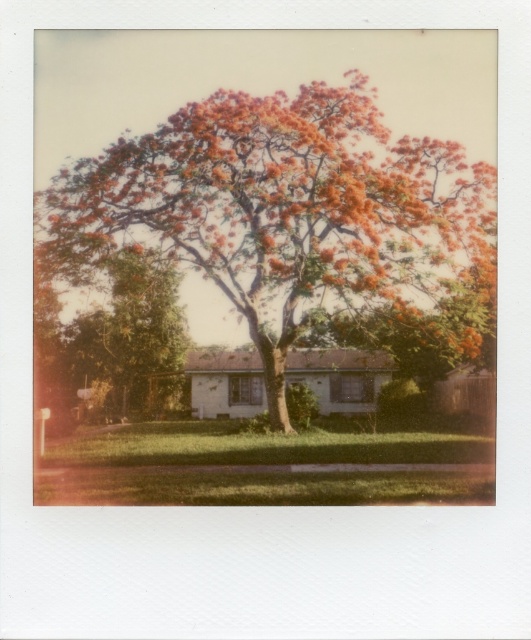
Question: Which point is farther from the camera taking this photo?

Choices:
 (A) (123, 221)
 (B) (157, 320)

Answer: (B)

Question: Can you confirm if orange-brown textured tree at center is positioned below green leafy tree at center?

Choices:
 (A) yes
 (B) no

Answer: (B)

Question: Is orange-brown textured tree at center further to camera compared to green leafy tree at center?

Choices:
 (A) yes
 (B) no

Answer: (B)

Question: Which of the following is the closest to the observer?

Choices:
 (A) orange-brown textured tree at center
 (B) green leafy tree at center

Answer: (A)

Question: Can you confirm if orange-brown textured tree at center is bigger than green leafy tree at center?

Choices:
 (A) yes
 (B) no

Answer: (A)